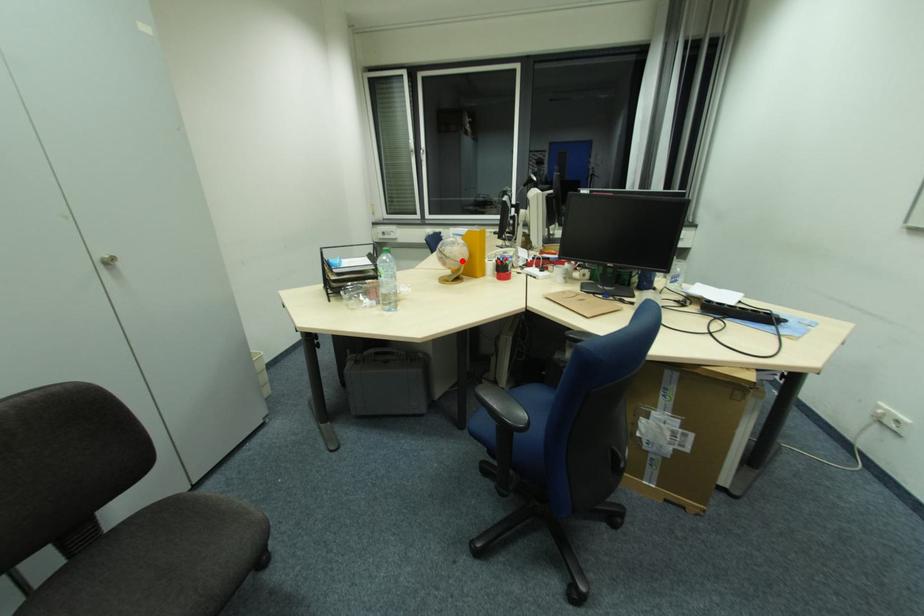
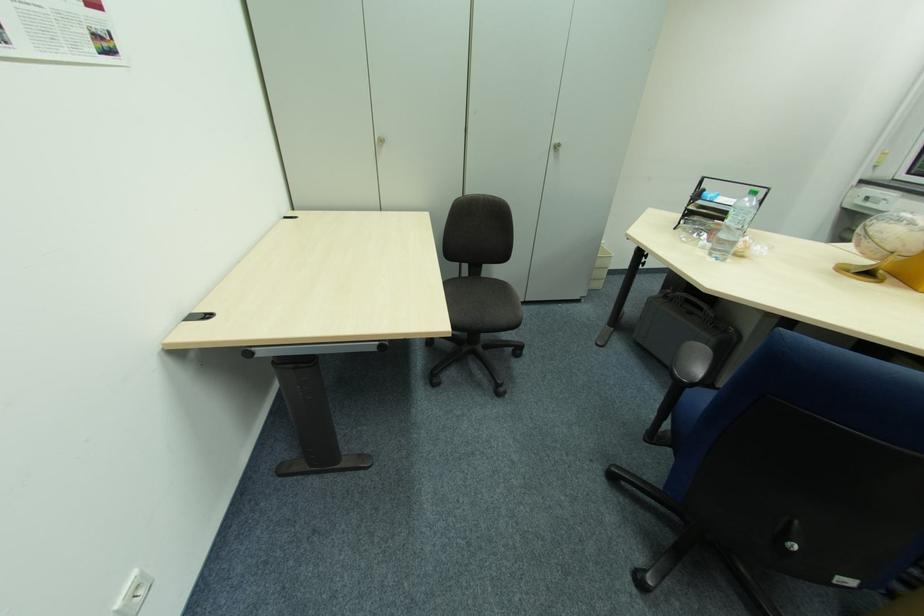
Find the pixel in the second image that matches the highlighted location in the first image.

(893, 249)